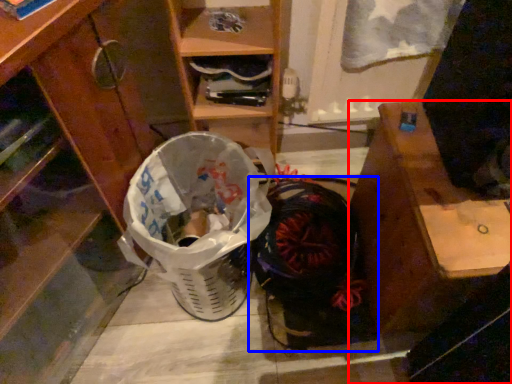
Question: Which point is further to the camera, desk (highlighted by a red box) or footwear (highlighted by a blue box)?

Choices:
 (A) desk
 (B) footwear

Answer: (B)